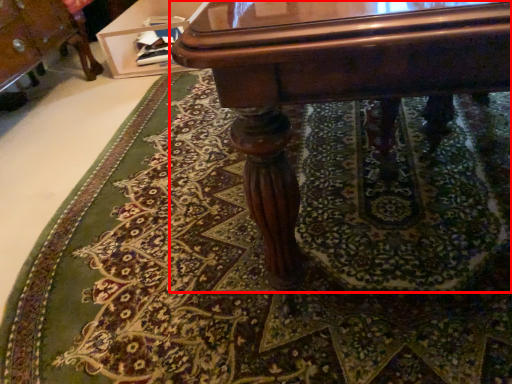
Question: From the image, what is the correct spatial relationship of table (annotated by the red box) in relation to vanity?

Choices:
 (A) right
 (B) left

Answer: (A)